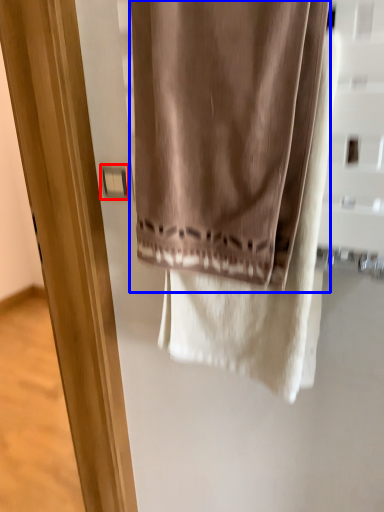
Question: Which point is closer to the camera, light switch (highlighted by a red box) or curtain (highlighted by a blue box)?

Choices:
 (A) light switch
 (B) curtain

Answer: (B)